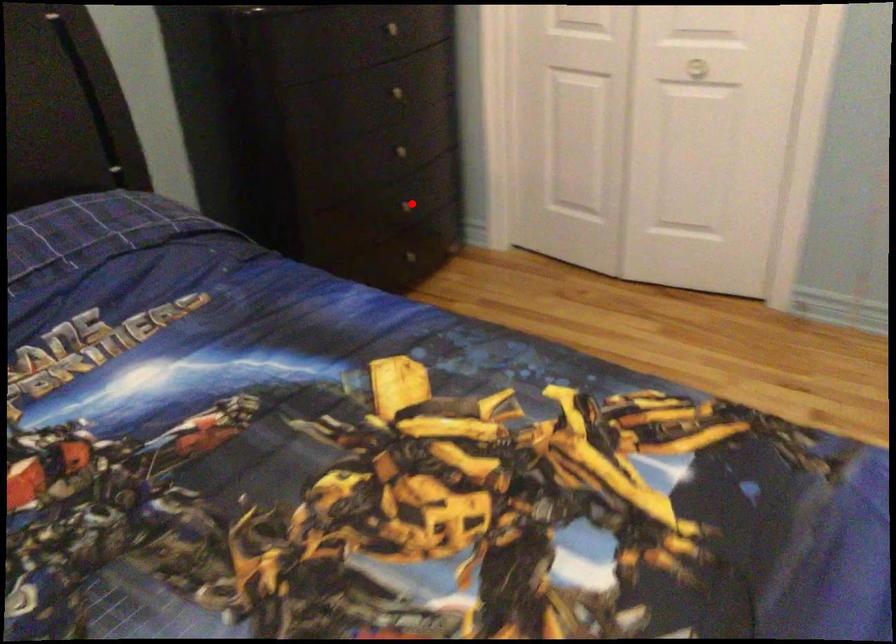
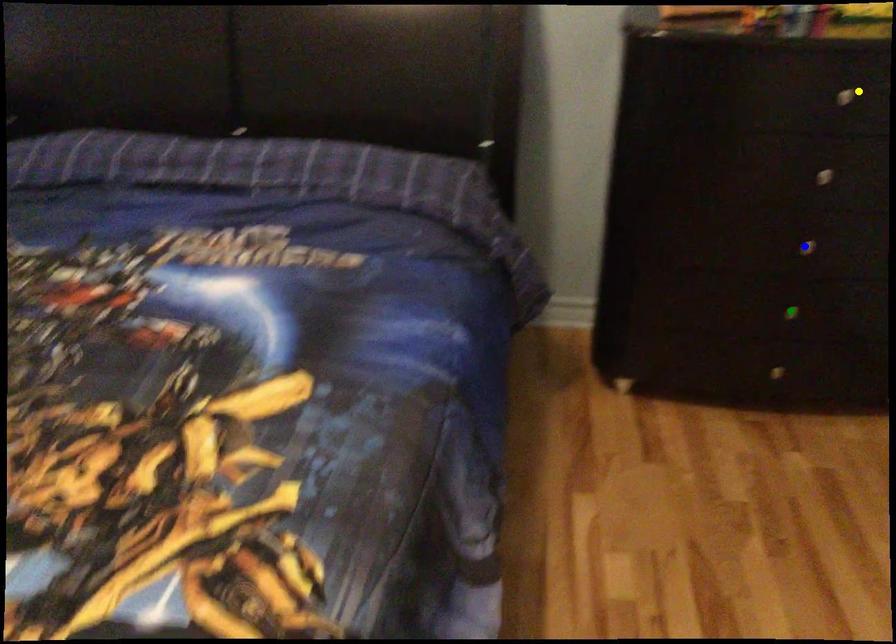
Question: I am providing you with two images of the same scene from different viewpoints. A red point is marked on the first image. You are given multiple points on the second image. Which point in image 2 is actually the same real-world point as the red point in image 1?

Choices:
 (A) yellow point
 (B) blue point
 (C) green point

Answer: (C)